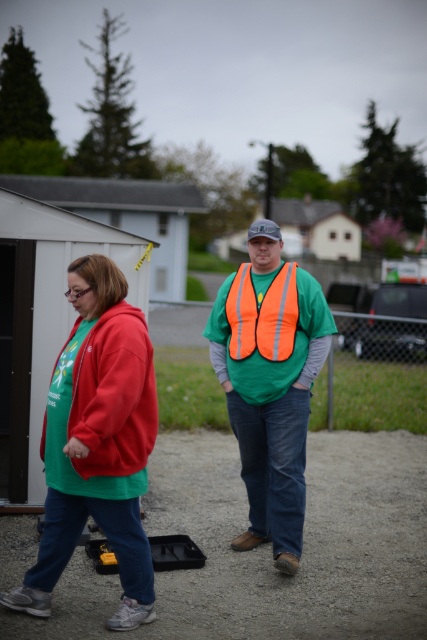
Who is positioned more to the right, matte green hoodie at left or matte green jacket at center?

matte green jacket at center

Which of these two, matte green hoodie at left or matte green jacket at center, stands taller?

matte green hoodie at left

Find the location of a particular element. matte green hoodie at left is located at coordinates (96, 445).

This screenshot has width=427, height=640. In order to click on matte green hoodie at left in this screenshot , I will do `click(96, 445)`.

Between matte fleece hoodie at left and matte green jacket at center, which one appears on the left side from the viewer's perspective?

matte fleece hoodie at left

Which of these two, matte fleece hoodie at left or matte green jacket at center, stands taller?

matte fleece hoodie at left is taller.

Does point (76, 308) come in front of point (210, 333)?

Yes, it is.

Identify the location of matte fleece hoodie at left. The width and height of the screenshot is (427, 640). (96, 442).

Can you confirm if matte fleece jacket at left is taller than matte green jacket at center?

Indeed, matte fleece jacket at left has a greater height compared to matte green jacket at center.

Which is above, matte fleece jacket at left or matte green jacket at center?

matte green jacket at center

At what (x,y) coordinates should I click in order to perform the action: click on matte fleece jacket at left. Please return your answer as a coordinate pair (x, y). Looking at the image, I should click on (114, 394).

The height and width of the screenshot is (640, 427). In order to click on matte fleece jacket at left in this screenshot , I will do `click(114, 394)`.